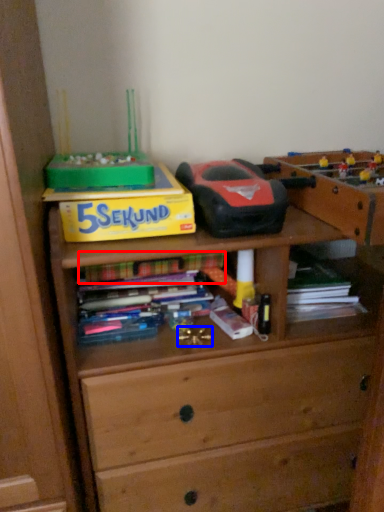
Question: Which of the following is the farthest to the observer, book (highlighted by a red box) or toy (highlighted by a blue box)?

Choices:
 (A) book
 (B) toy

Answer: (A)